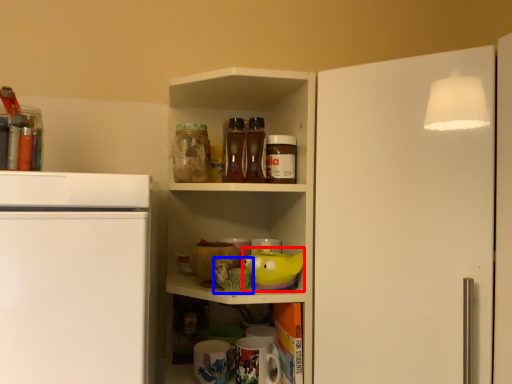
Question: Among these objects, which one is farthest to the camera, toy (highlighted by a red box) or toy (highlighted by a blue box)?

Choices:
 (A) toy
 (B) toy

Answer: (A)